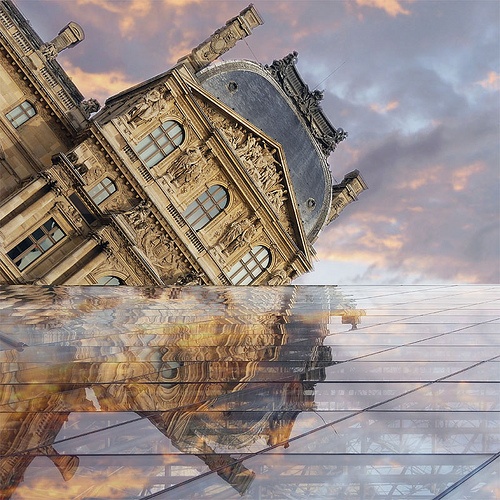
The height and width of the screenshot is (500, 500). In order to click on glass wall in this screenshot , I will do `click(378, 370)`.